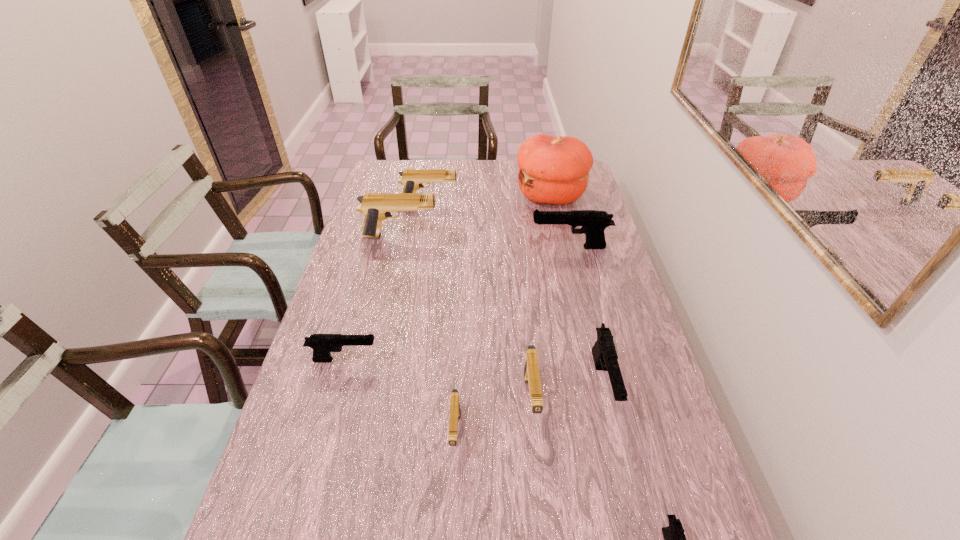
Image resolution: width=960 pixels, height=540 pixels. In order to click on unoccupied area between the third tan pistol from left to right and the fourth farthest object in this screenshot , I will do `click(513, 340)`.

Locate an element on the screen. Image resolution: width=960 pixels, height=540 pixels. empty location between the fourth pistol from left to right and the pumpkin is located at coordinates (503, 314).

You are a GUI agent. You are given a task and a screenshot of the screen. Output one action in this format:
    pyautogui.click(x=<x>, y=<y>)
    Task: Click on the unoccupied position between the smallest tan pistol and the fourth pistol from right to left
    
    Given the screenshot: What is the action you would take?
    pyautogui.click(x=493, y=416)

Identify the location of free space that is in between the leftmost black pistol and the third smallest black pistol. (474, 372).

At what (x,y) coordinates should I click in order to perform the action: click on empty location between the fourth farthest object and the second biggest black pistol. Please return your answer as a coordinate pair (x, y). Image resolution: width=960 pixels, height=540 pixels. Looking at the image, I should click on (587, 315).

Identify which object is the fourth closest to the nearest black pistol. Please provide its 2D coordinates. Your answer should be formatted as a tuple, i.e. [(x, y)], where the tuple contains the x and y coordinates of a point satisfying the conditions above.

[(322, 344)]

Find the location of `object that can be found as the third closest to the sixth nearest object`. object that can be found as the third closest to the sixth nearest object is located at coordinates (412, 179).

Identify which pistol is the fifth nearest to the fourth pistol from left to right. Please provide its 2D coordinates. Your answer should be formatted as a tuple, i.e. [(x, y)], where the tuple contains the x and y coordinates of a point satisfying the conditions above.

[(593, 222)]

Where is `pistol that is the fifth closest to the second smallest black pistol`? The image size is (960, 540). pistol that is the fifth closest to the second smallest black pistol is located at coordinates (593, 222).

The height and width of the screenshot is (540, 960). Identify the location of the second closest tan pistol to the second farthest tan pistol. (531, 367).